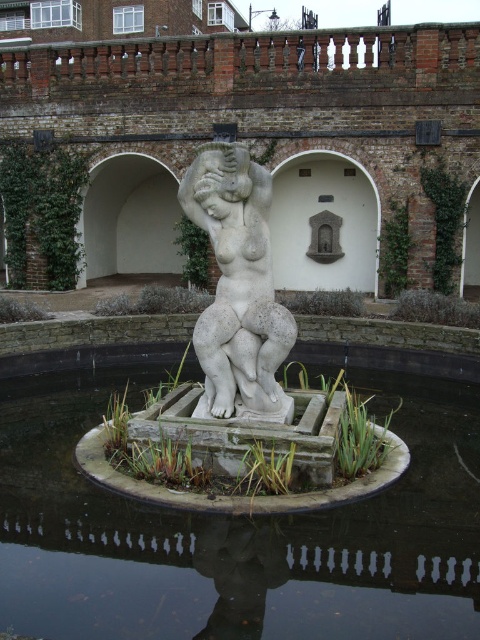
You are standing in front of the statue and want to take a photo. There are two points marked in the scene, point (63, 456) and point (248, 268). Which point is closer to your camera lens?

Point (63, 456) is further to the camera than point (248, 268), so the point closer to your camera lens is point (248, 268).

You are standing in front of the statue and want to walk to the edge of the pool. Which direction should you move relative to the white stone statue at center and the white stone water at center?

Since the white stone water at center is to the left of the white stone statue at center, you should move to the right of the white stone statue at center to reach the edge of the pool.